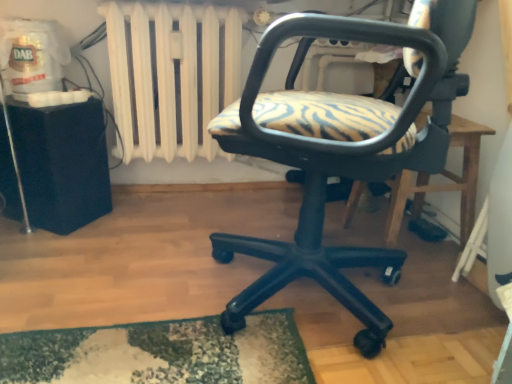
Question: Is point (53, 122) positioned closer to the camera than point (313, 16)?

Choices:
 (A) farther
 (B) closer

Answer: (A)

Question: From the image's perspective, relative to matte black office chair at center, is black plastic table at left, the 2th table viewed from the right, above or below?

Choices:
 (A) above
 (B) below

Answer: (A)

Question: Considering the real-world distances, which object is farthest from the white painted metal radiator at upper center?

Choices:
 (A) black plastic table at left, the 2th table viewed from the right
 (B) matte black office chair at center
 (C) wooden table at center, which appears as the first table when viewed from the right

Answer: (C)

Question: Which of these objects is positioned farthest from the wooden table at center, which appears as the first table when viewed from the right?

Choices:
 (A) matte black office chair at center
 (B) white painted metal radiator at upper center
 (C) black plastic table at left, the 2th table viewed from the right

Answer: (C)